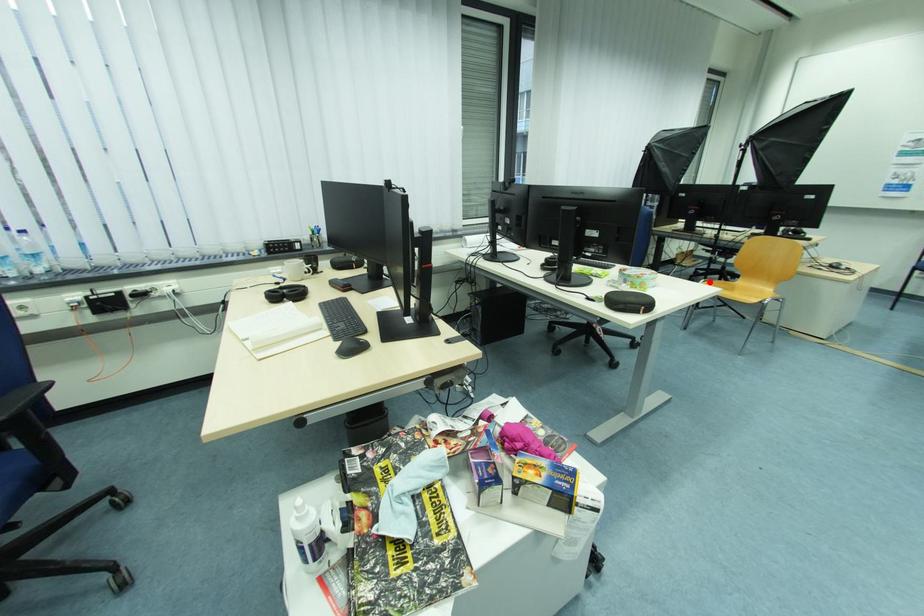
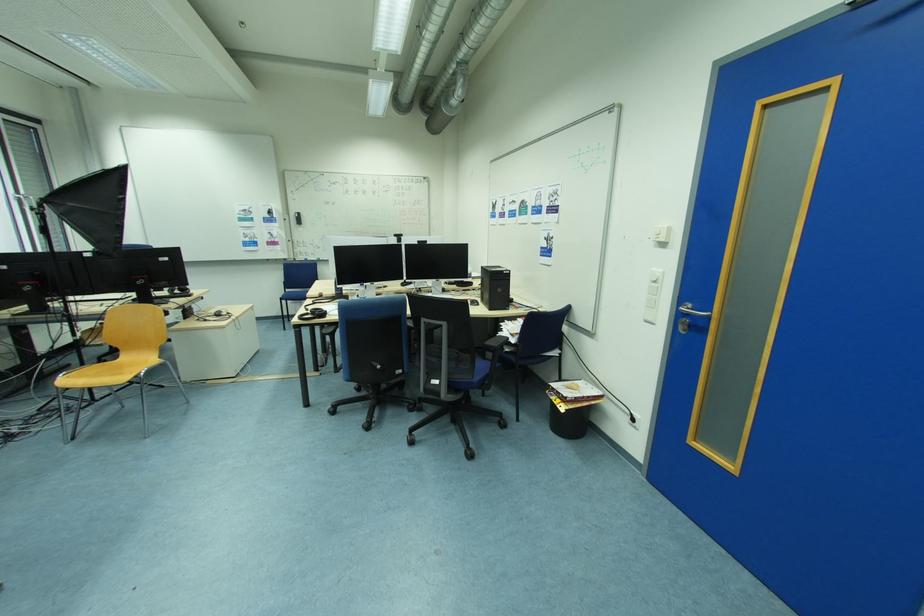
Question: I am providing you with two images of the same scene from different viewpoints. In image1, a red point is highlighted. Considering the same 3D point in image2, which of the following is correct?

Choices:
 (A) It is closer
 (B) It is farther

Answer: (B)